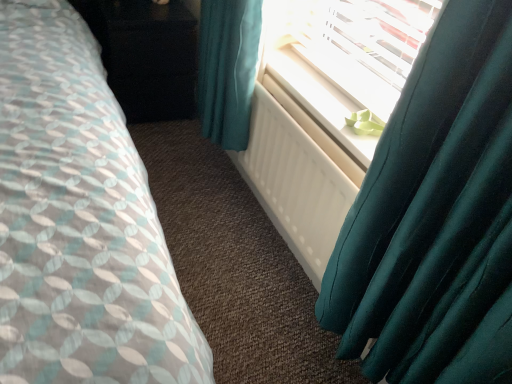
Question: Is teal satin curtain at right wider than black glossy dresser at upper left?

Choices:
 (A) no
 (B) yes

Answer: (A)

Question: Is teal satin curtain at right positioned with its back to black glossy dresser at upper left?

Choices:
 (A) yes
 (B) no

Answer: (B)

Question: From the image's perspective, does teal satin curtain at right appear higher than black glossy dresser at upper left?

Choices:
 (A) yes
 (B) no

Answer: (B)

Question: From a real-world perspective, is teal satin curtain at right on top of black glossy dresser at upper left?

Choices:
 (A) no
 (B) yes

Answer: (B)

Question: Can you confirm if teal satin curtain at right is positioned to the left of black glossy dresser at upper left?

Choices:
 (A) no
 (B) yes

Answer: (A)

Question: Looking at their shapes, would you say white matte radiator at center is wider or thinner than teal satin curtain at right?

Choices:
 (A) thin
 (B) wide

Answer: (A)

Question: In the image, is white matte radiator at center on the left side or the right side of teal satin curtain at right?

Choices:
 (A) left
 (B) right

Answer: (A)

Question: From a real-world perspective, is white matte radiator at center above or below teal satin curtain at right?

Choices:
 (A) above
 (B) below

Answer: (B)

Question: Considering the positions of white matte radiator at center and teal satin curtain at right in the image, is white matte radiator at center taller or shorter than teal satin curtain at right?

Choices:
 (A) tall
 (B) short

Answer: (B)

Question: Based on their positions, is white plastic radiator at upper center located to the left or right of white matte radiator at center?

Choices:
 (A) left
 (B) right

Answer: (B)

Question: From a real-world perspective, is white plastic radiator at upper center above or below white matte radiator at center?

Choices:
 (A) above
 (B) below

Answer: (A)

Question: In the image, is white plastic radiator at upper center positioned in front of or behind white matte radiator at center?

Choices:
 (A) behind
 (B) front

Answer: (A)

Question: From the image's perspective, is white plastic radiator at upper center above or below white matte radiator at center?

Choices:
 (A) below
 (B) above

Answer: (B)

Question: In terms of width, does white plastic radiator at upper center look wider or thinner when compared to teal satin curtain at right?

Choices:
 (A) wide
 (B) thin

Answer: (B)

Question: Does point (317, 114) appear closer or farther from the camera than point (440, 11)?

Choices:
 (A) closer
 (B) farther

Answer: (B)